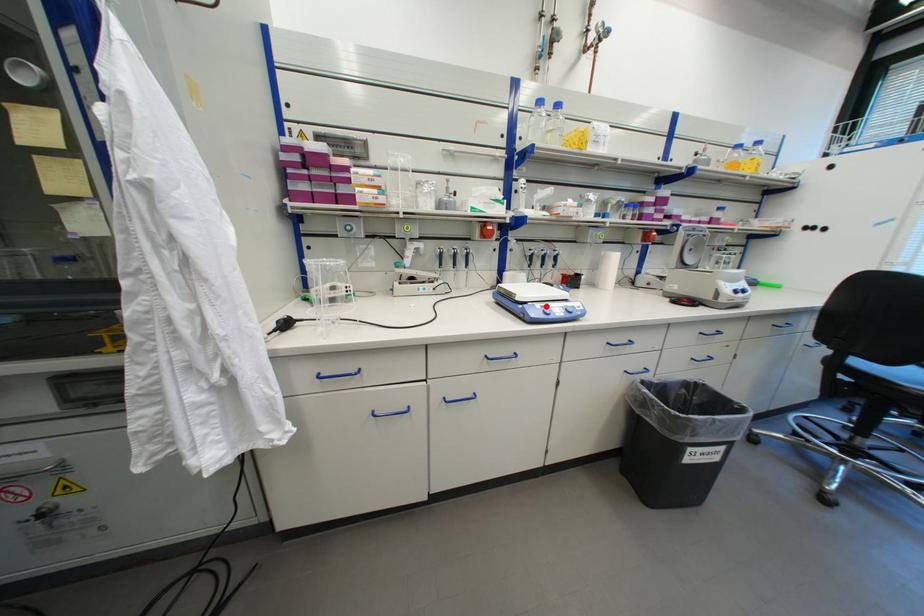
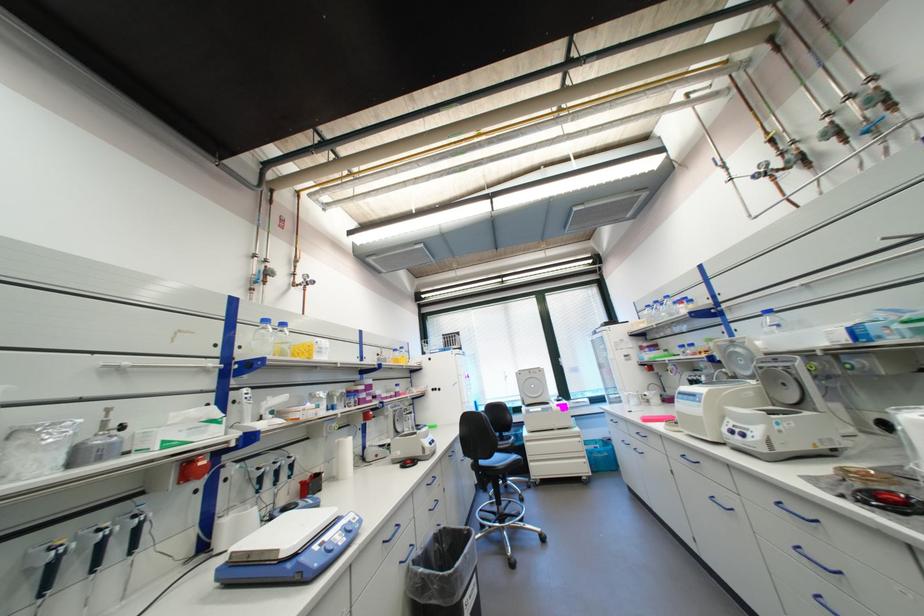
In the second image, find the point that corresponds to the highlighted location in the first image.

(323, 548)